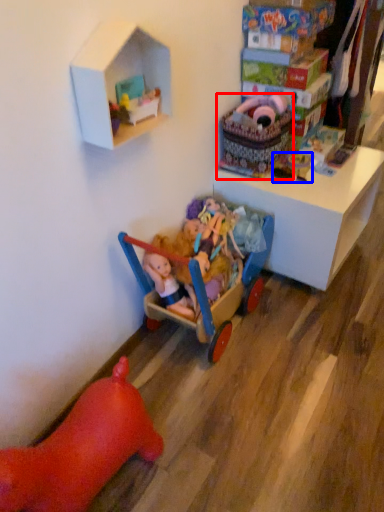
Question: Which object appears farthest to the camera in this image, toy (highlighted by a red box) or toy (highlighted by a blue box)?

Choices:
 (A) toy
 (B) toy

Answer: (B)